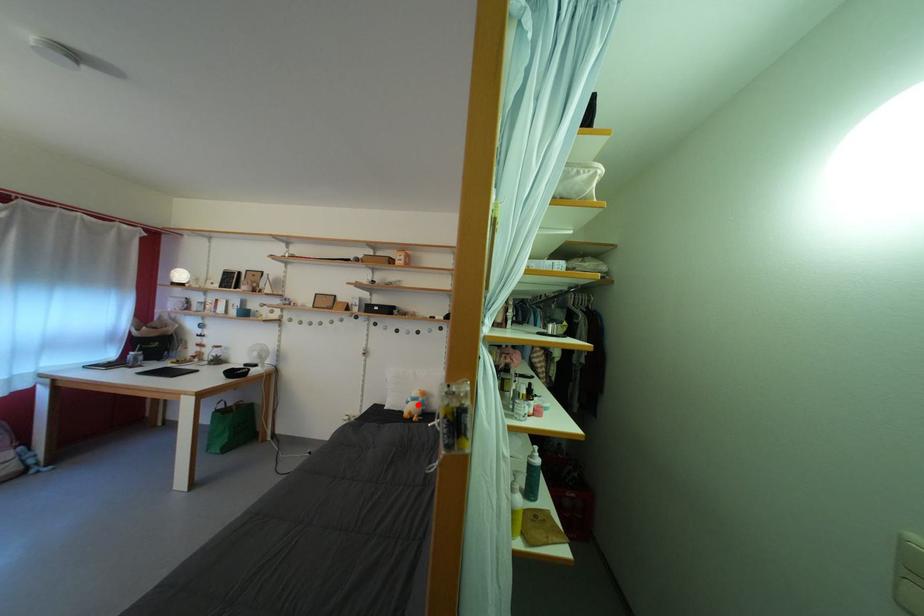
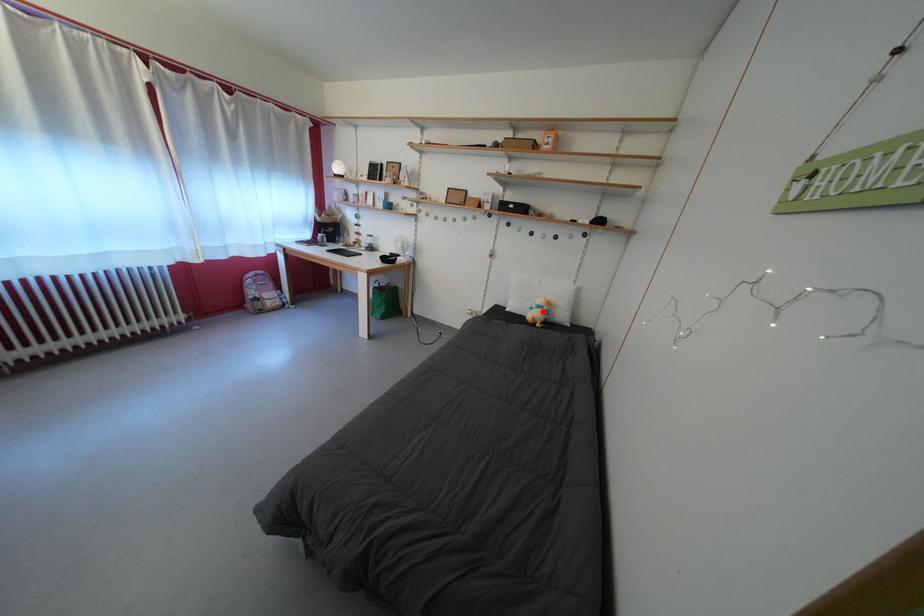
I am providing you with two images of the same scene from different viewpoints. A red point is marked on the first image and another point is marked on the second image. Does the point marked in image1 correspond to the same location as the one in image2?

Yes